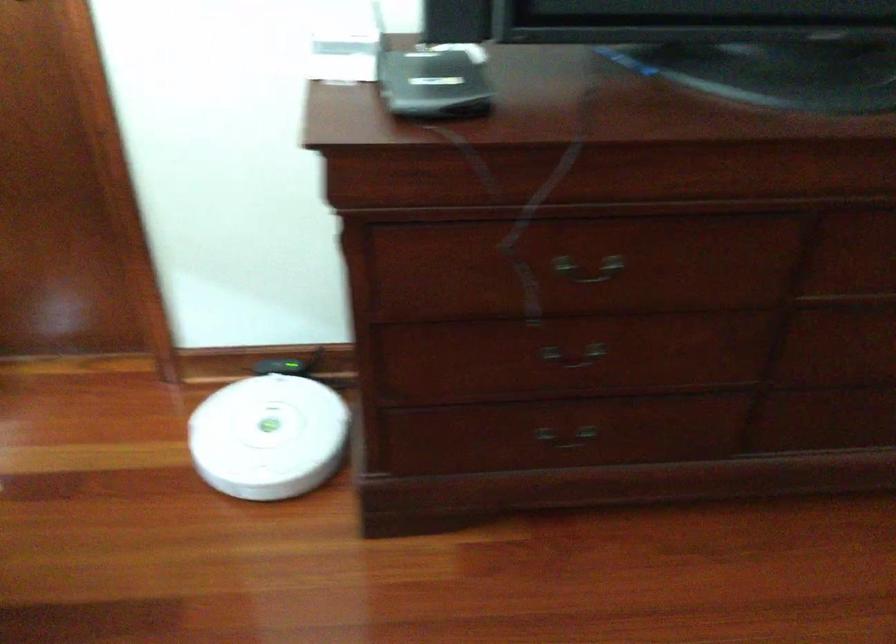
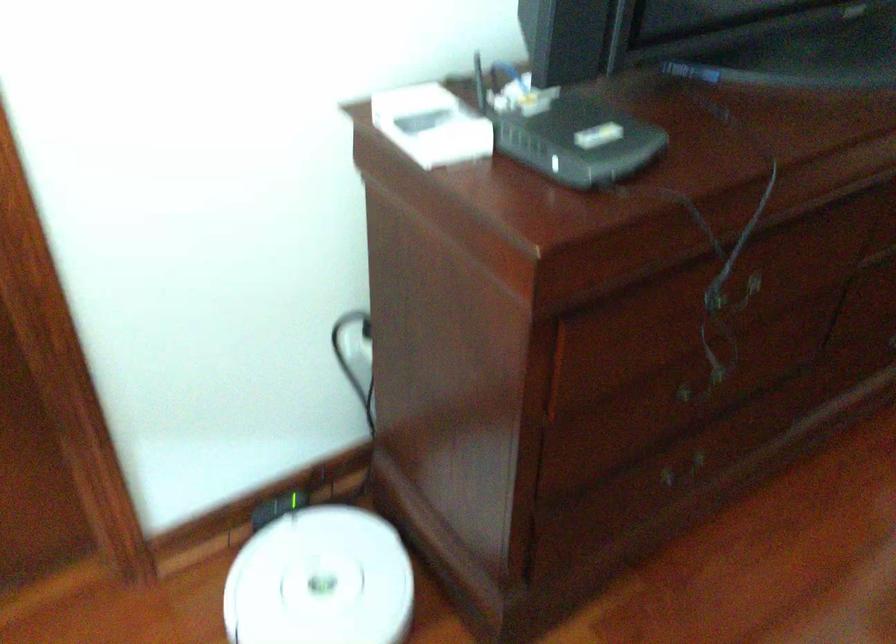
In the second image, find the point that corresponds to [573,444] in the first image.

(684, 473)